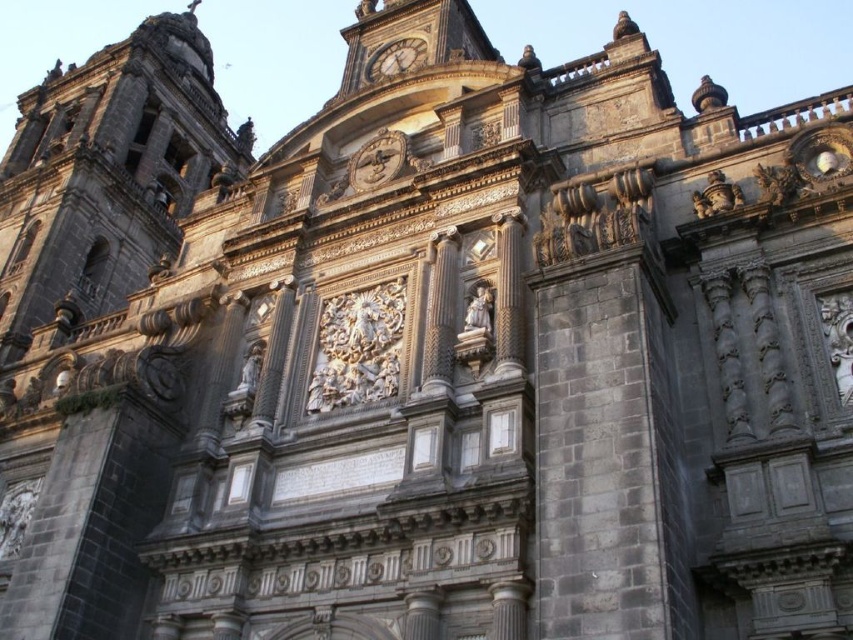
Question: From the image, what is the correct spatial relationship of gold metallic clock at center in relation to gold metallic clock at upper center?

Choices:
 (A) above
 (B) below

Answer: (B)

Question: Where is gold metallic clock at center located in relation to gold metallic clock at upper center in the image?

Choices:
 (A) right
 (B) left

Answer: (B)

Question: From the image, what is the correct spatial relationship of gold metallic clock at center in relation to gold metallic clock at upper center?

Choices:
 (A) above
 (B) below

Answer: (B)